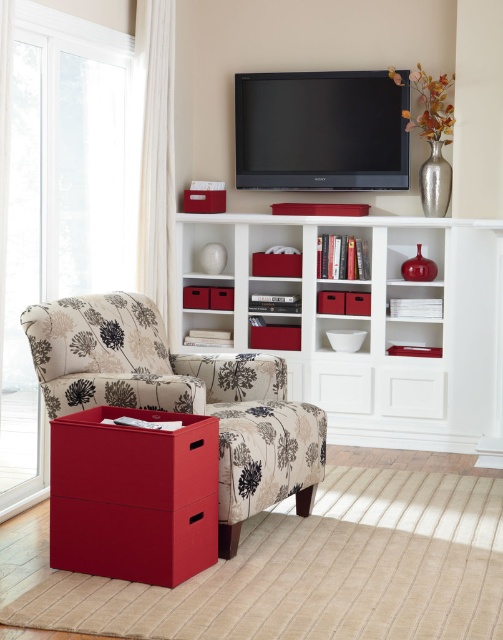
Is flat screen tv at upper center to the left of matte fabric drawer at lower left from the viewer's perspective?

In fact, flat screen tv at upper center is to the right of matte fabric drawer at lower left.

The image size is (503, 640). Find the location of `flat screen tv at upper center`. flat screen tv at upper center is located at coordinates (320, 131).

Where is `flat screen tv at upper center`? Image resolution: width=503 pixels, height=640 pixels. flat screen tv at upper center is located at coordinates (320, 131).

Who is more distant from viewer, [299,397] or [90,477]?

The point [299,397] is behind.

Is white matte bookshelf at center to the left of matte fabric drawer at lower left from the viewer's perspective?

In fact, white matte bookshelf at center is to the right of matte fabric drawer at lower left.

What are the coordinates of `white matte bookshelf at center` in the screenshot? It's located at (376, 326).

Between white matte bookshelf at center and floral fabric armchair at left, which one is positioned higher?

white matte bookshelf at center is above.

Is white matte bookshelf at center wider than floral fabric armchair at left?

Correct, the width of white matte bookshelf at center exceeds that of floral fabric armchair at left.

Is point (351, 394) positioned after point (249, 355)?

Yes, point (351, 394) is behind point (249, 355).

You are a GUI agent. You are given a task and a screenshot of the screen. Output one action in this format:
    pyautogui.click(x=<x>, y=<y>)
    Task: Click on the white matte bookshelf at center
    
    Given the screenshot: What is the action you would take?
    pyautogui.click(x=376, y=326)